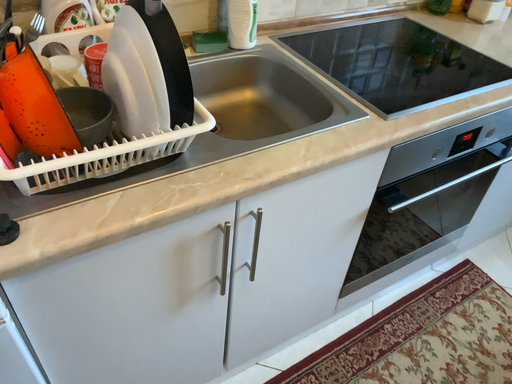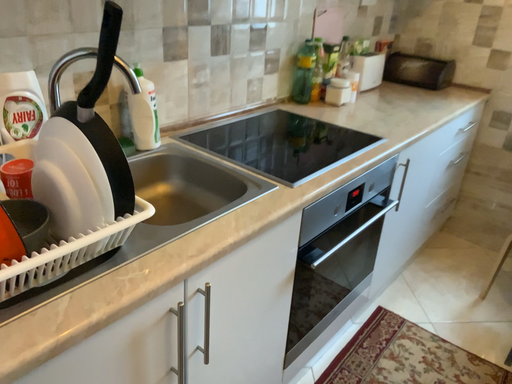
Question: How did the camera likely rotate when shooting the video?

Choices:
 (A) rotated left
 (B) rotated right

Answer: (B)